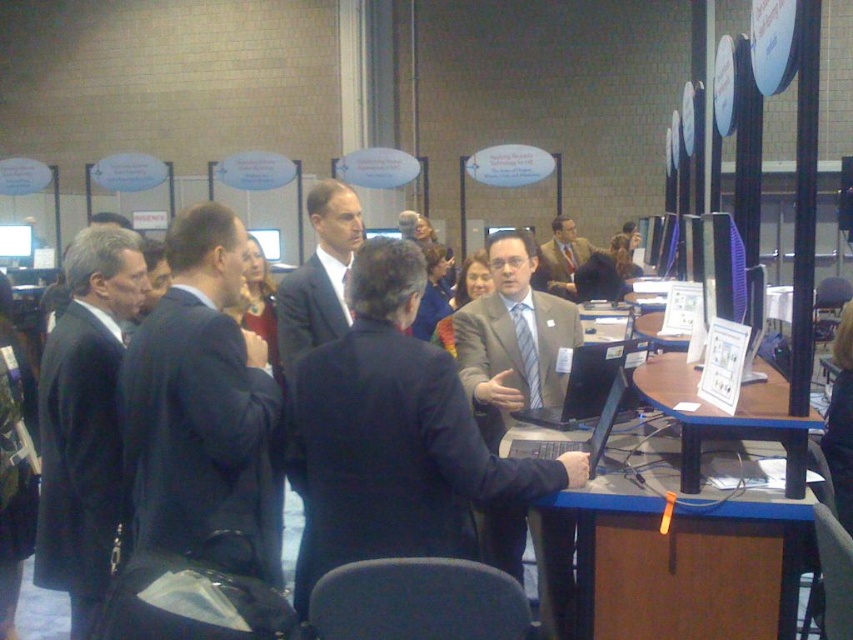
You are standing at the point labeled point (547, 280) and want to reach the desk where the man in the suit is sitting. Can you walk directly towards point (193, 412) without any obstacles in your path?

Yes, since point (193, 412) is in front of point (547, 280), you can walk directly towards it without any obstacles in your path.

You are standing in the conference hall and want to determine which of the two points, point (181, 337) or point (312, 312), is nearer to your current position. Based on the scene, which point is closer?

Point (181, 337) is closer to the camera than point (312, 312), so it is nearer to your current position.